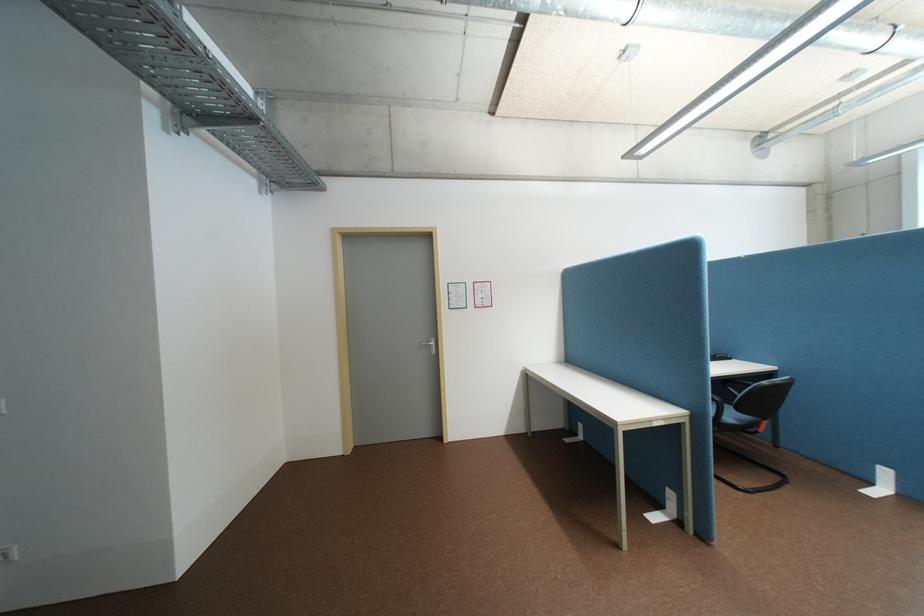
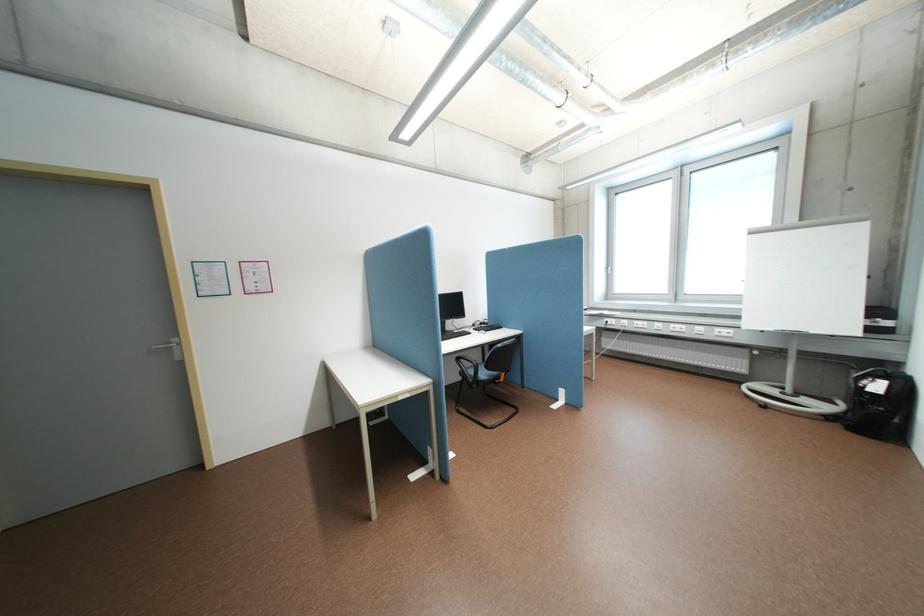
Where in the second image is the point corresponding to point (662, 419) from the first image?

(407, 395)